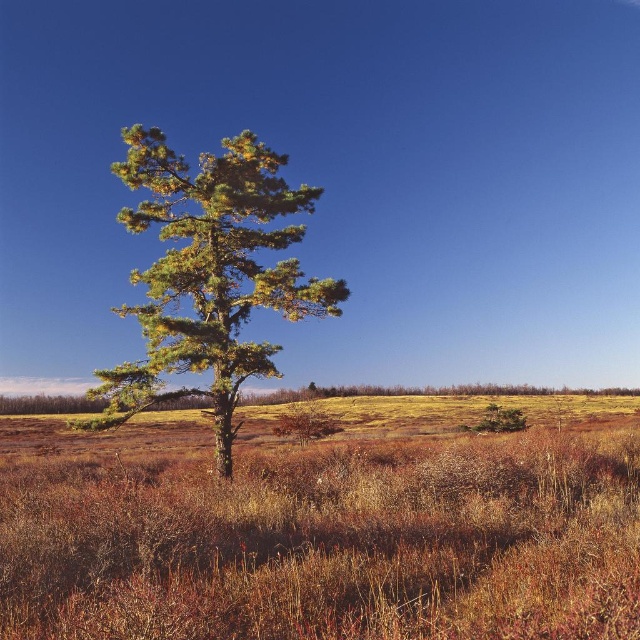
Does brown dry grass at center have a larger size compared to green needle-like tree at left?

Indeed, brown dry grass at center has a larger size compared to green needle-like tree at left.

Locate an element on the screen. brown dry grass at center is located at coordinates (324, 525).

What are the coordinates of `brown dry grass at center` in the screenshot? It's located at (324, 525).